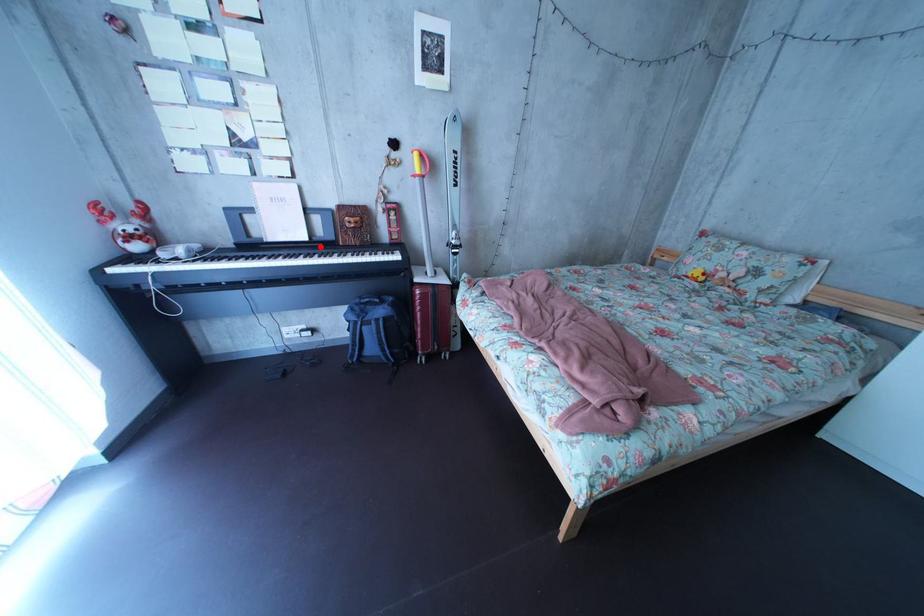
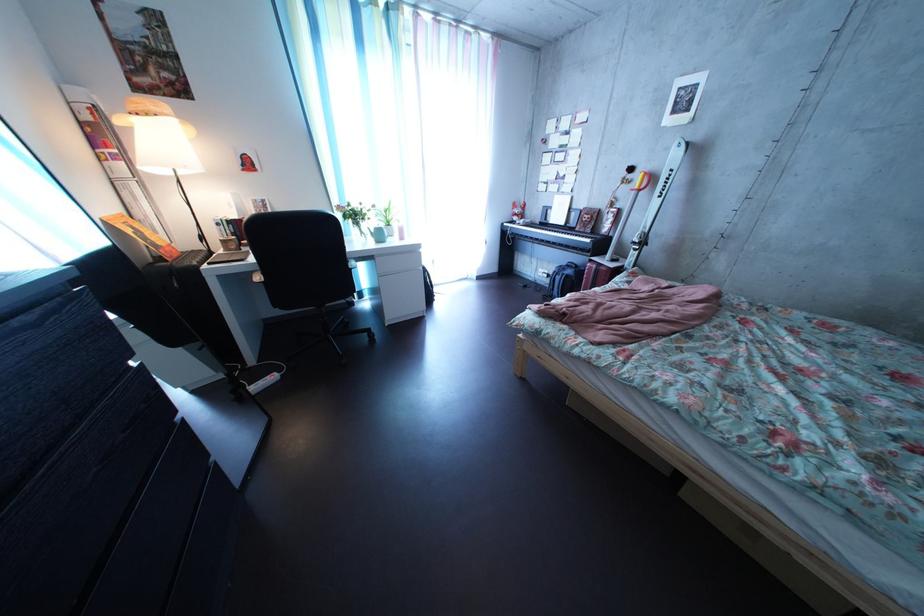
Question: I am providing you with two images of the same scene from different viewpoints. A red point is marked on the first image. Can you still see the location of the red point in image 2?

Choices:
 (A) Yes
 (B) No

Answer: (A)